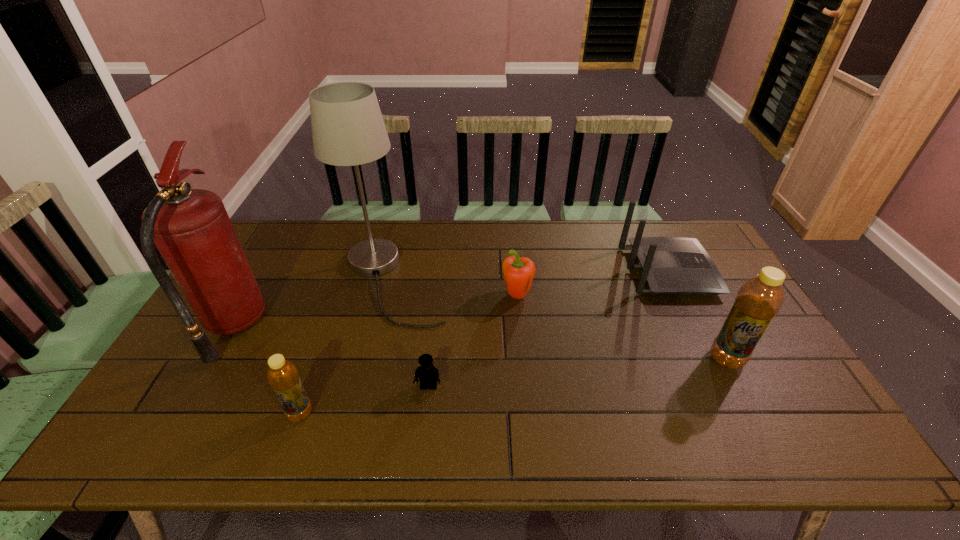
The image size is (960, 540). What are the coordinates of `Lego that is at the near edge` in the screenshot? It's located at (427, 373).

Identify the location of object situated at the left edge. The width and height of the screenshot is (960, 540). (191, 228).

The width and height of the screenshot is (960, 540). What are the coordinates of `bottle located at the right edge` in the screenshot? It's located at (759, 299).

This screenshot has height=540, width=960. I want to click on router positioned at the right edge, so click(x=669, y=265).

Where is `object that is at the far right corner`? object that is at the far right corner is located at coordinates (669, 265).

The image size is (960, 540). In order to click on vacant space at the far edge of the desktop in this screenshot , I will do `click(420, 232)`.

The height and width of the screenshot is (540, 960). In the image, there is a desktop. Find the location of `free space at the near edge`. free space at the near edge is located at coordinates (445, 409).

At what (x,y) coordinates should I click in order to perform the action: click on free spot at the near left corner of the desktop. Please return your answer as a coordinate pair (x, y). This screenshot has width=960, height=540. Looking at the image, I should click on (201, 406).

Locate an element on the screen. The width and height of the screenshot is (960, 540). vacant space at the far right corner of the desktop is located at coordinates (710, 252).

You are a GUI agent. You are given a task and a screenshot of the screen. Output one action in this format:
    pyautogui.click(x=<x>, y=<y>)
    Task: Click on the blank region between the router and the fifth object from left to right
    
    Given the screenshot: What is the action you would take?
    pyautogui.click(x=592, y=284)